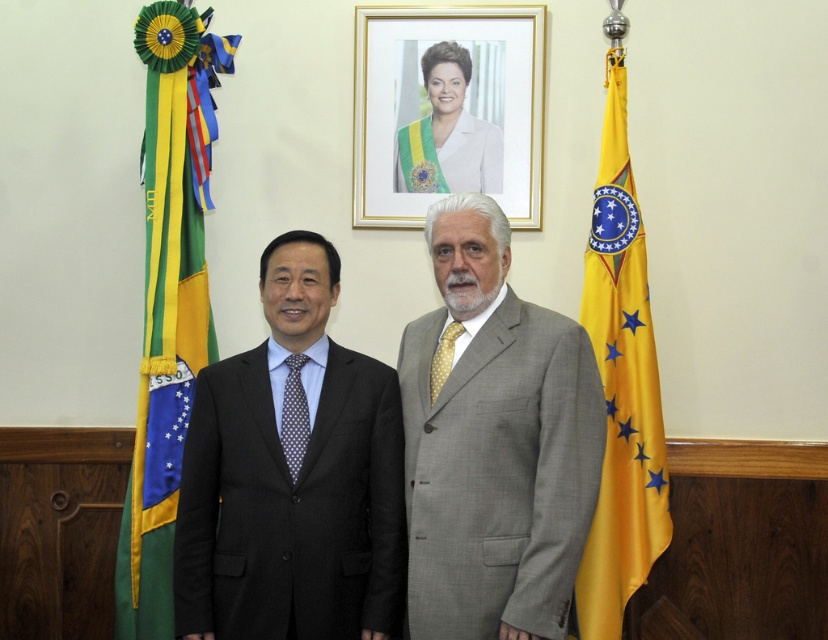
Question: From the image, what is the correct spatial relationship of gray wool suit at center in relation to black suit at center?

Choices:
 (A) left
 (B) right

Answer: (B)

Question: Which object is farther from the camera taking this photo?

Choices:
 (A) black pinstripe suit at center
 (B) gray wool suit at center
 (C) gold-framed portrait at upper center

Answer: (C)

Question: Among these points, which one is nearest to the camera?

Choices:
 (A) (450, 51)
 (B) (576, 392)

Answer: (B)

Question: Is black suit at center wider than gold-framed portrait at upper center?

Choices:
 (A) no
 (B) yes

Answer: (A)

Question: From the image, what is the correct spatial relationship of gold-framed portrait at upper center in relation to white glossy portrait at upper center?

Choices:
 (A) above
 (B) below

Answer: (A)

Question: Which object is farther from the camera taking this photo?

Choices:
 (A) yellow fabric flag at right
 (B) black pinstripe suit at center
 (C) gold-framed portrait at upper center

Answer: (C)